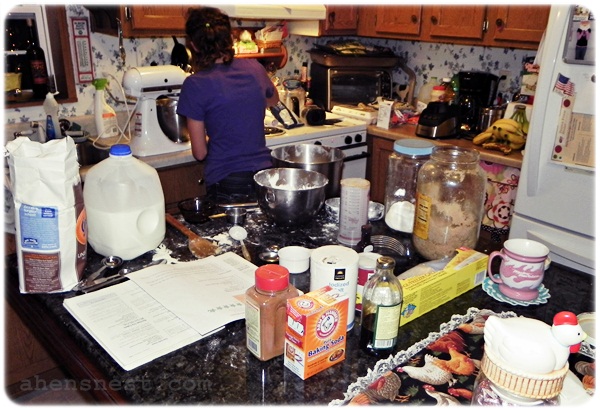
Find the location of `stove`. stove is located at coordinates (312, 130).